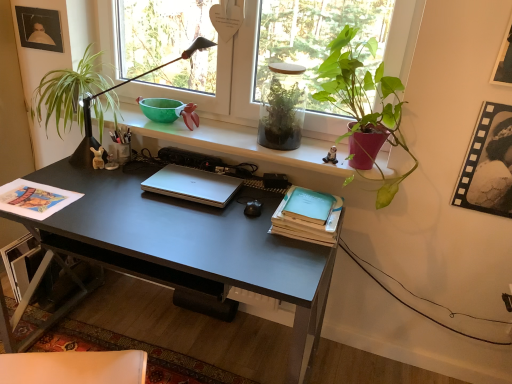
Where is `free space between light blue matte paper at center right, arranged as the 1th paperback book when ordered from the bottom, and silver metallic laptop at center`? Image resolution: width=512 pixels, height=384 pixels. free space between light blue matte paper at center right, arranged as the 1th paperback book when ordered from the bottom, and silver metallic laptop at center is located at coordinates (x=237, y=210).